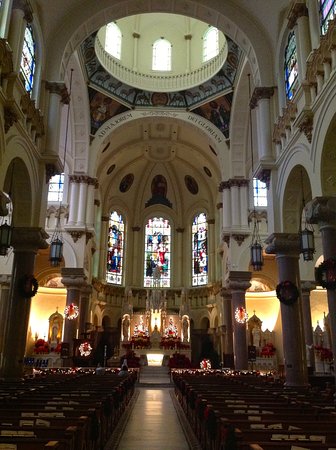
Where is `column`? This screenshot has height=450, width=336. column is located at coordinates [x=21, y=296], [x=294, y=325], [x=239, y=299], [x=228, y=309], [x=71, y=326], [x=84, y=305], [x=328, y=249].